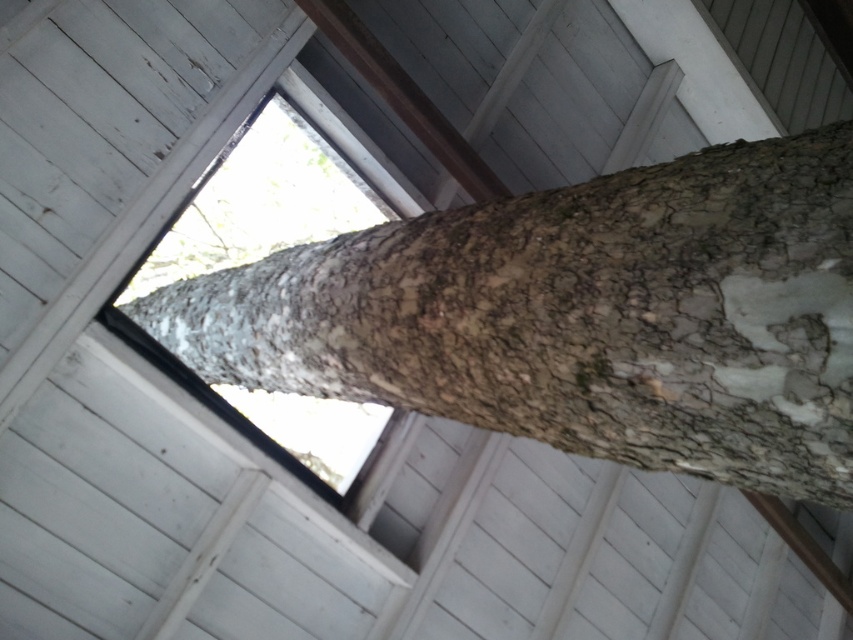
Which is below, rough bark tree at center or transparent glass window at center?

Positioned lower is rough bark tree at center.

Which of these two, rough bark tree at center or transparent glass window at center, stands taller?

With more height is transparent glass window at center.

The width and height of the screenshot is (853, 640). What are the coordinates of `rough bark tree at center` in the screenshot? It's located at (578, 316).

Image resolution: width=853 pixels, height=640 pixels. In order to click on rough bark tree at center in this screenshot , I will do `click(578, 316)`.